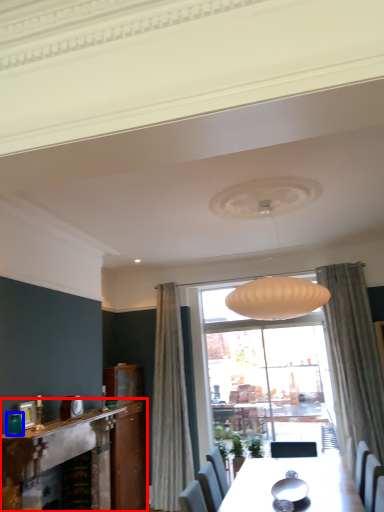
Question: Which object appears farthest to the camera in this image, fireplace (highlighted by a red box) or teal (highlighted by a blue box)?

Choices:
 (A) fireplace
 (B) teal

Answer: (B)